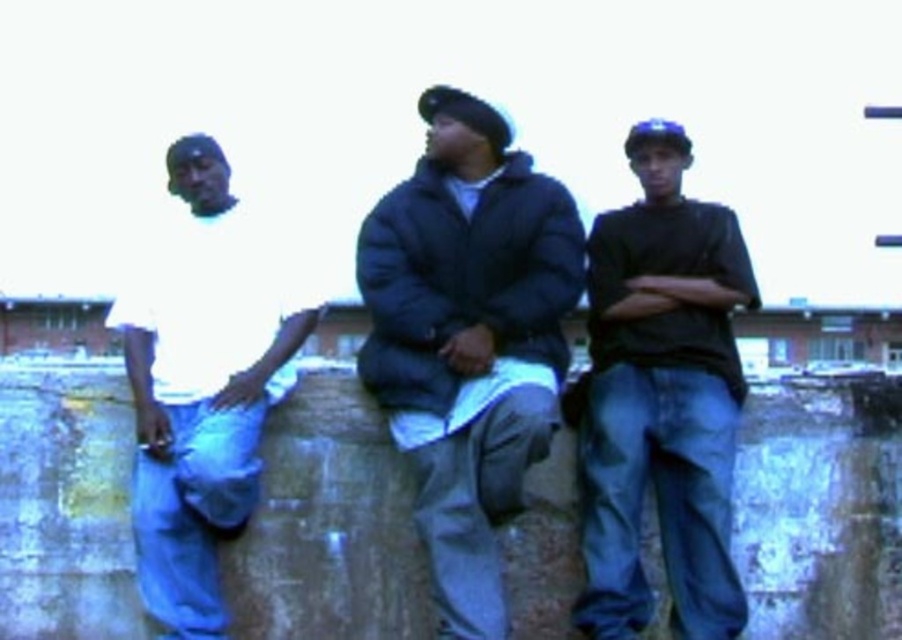
Is dark blue puffy jacket at center further to the viewer compared to matte black shirt at center?

No, it is in front of matte black shirt at center.

Between dark blue puffy jacket at center and matte black shirt at center, which one has less height?

With less height is matte black shirt at center.

Find the location of a particular element. dark blue puffy jacket at center is located at coordinates (468, 337).

Can you confirm if dark blue puffy jacket at center is smaller than white matte shirt at left?

Incorrect, dark blue puffy jacket at center is not smaller in size than white matte shirt at left.

Who is positioned more to the right, dark blue puffy jacket at center or white matte shirt at left?

dark blue puffy jacket at center

The height and width of the screenshot is (640, 902). What are the coordinates of `dark blue puffy jacket at center` in the screenshot? It's located at (468, 337).

Measure the distance from matte black shirt at center to white matte shirt at left.

matte black shirt at center and white matte shirt at left are 17.61 meters apart.

Does matte black shirt at center have a larger size compared to white matte shirt at left?

Incorrect, matte black shirt at center is not larger than white matte shirt at left.

Which is behind, point (668, 148) or point (185, 176)?

Point (668, 148)

You are a GUI agent. You are given a task and a screenshot of the screen. Output one action in this format:
    pyautogui.click(x=<x>, y=<y>)
    Task: Click on the matte black shirt at center
    This screenshot has height=640, width=902.
    Given the screenshot: What is the action you would take?
    pyautogui.click(x=661, y=397)